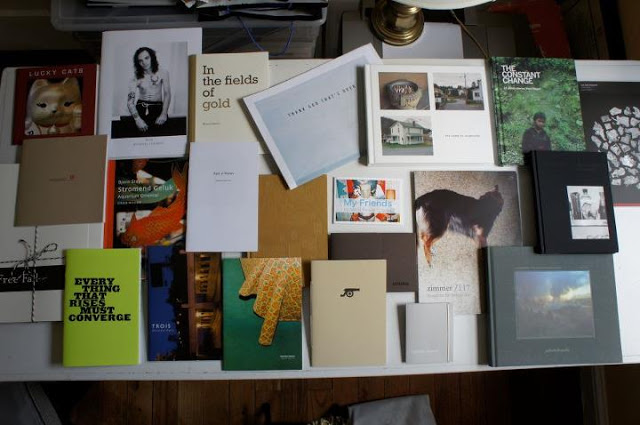
The height and width of the screenshot is (425, 640). I want to click on lamp, so click(400, 36).